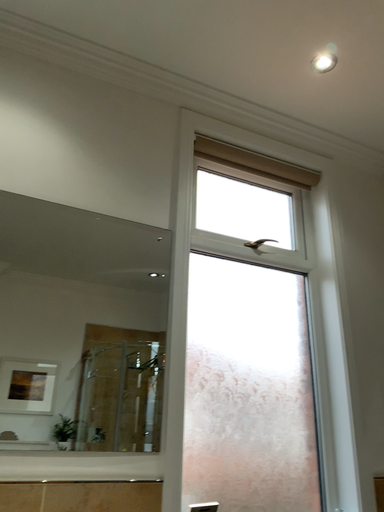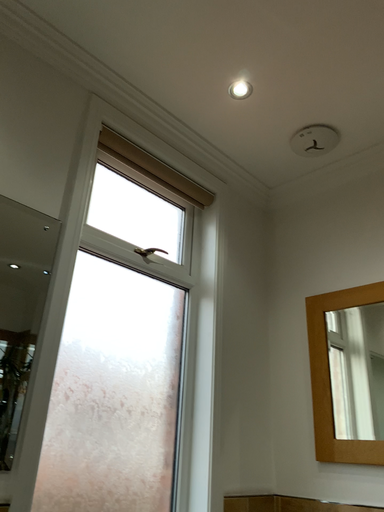
Question: How did the camera likely rotate when shooting the video?

Choices:
 (A) rotated right
 (B) rotated left

Answer: (A)